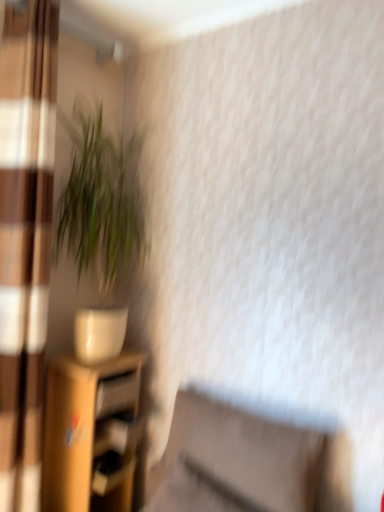
Question: Considering their positions, is matte brown curtain at left located in front of or behind wooden drawer at lower left?

Choices:
 (A) front
 (B) behind

Answer: (A)

Question: Is matte brown curtain at left to the left or to the right of wooden drawer at lower left in the image?

Choices:
 (A) left
 (B) right

Answer: (A)

Question: Which object is positioned farthest from the matte brown swivel chair at lower center?

Choices:
 (A) green leafy plant at left
 (B) wooden drawer at lower left
 (C) wooden shelf at lower left
 (D) matte brown curtain at left

Answer: (A)

Question: Estimate the real-world distances between objects in this image. Which object is closer to the wooden drawer at lower left?

Choices:
 (A) wooden shelf at lower left
 (B) matte brown curtain at left
 (C) matte brown swivel chair at lower center
 (D) green leafy plant at left

Answer: (A)